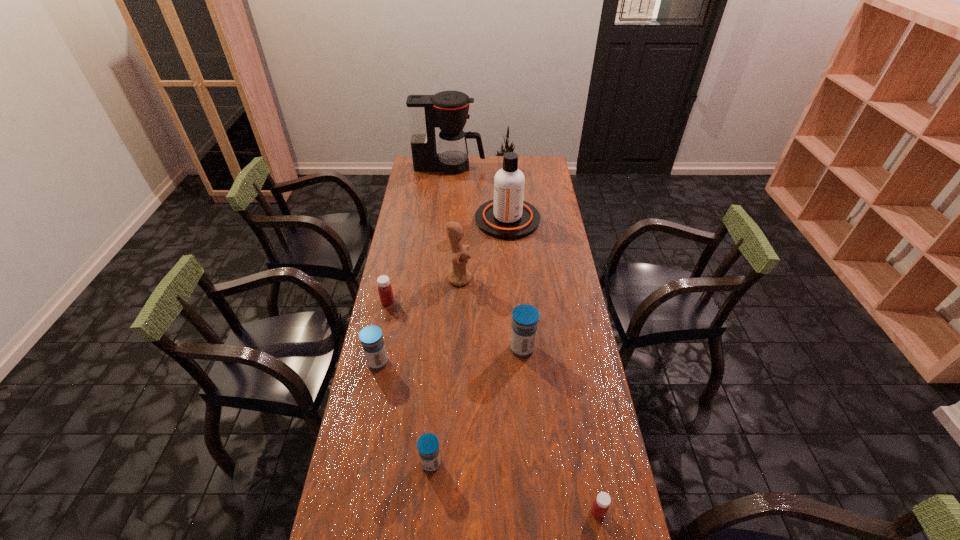
Where is `the fourth farthest object`? the fourth farthest object is located at coordinates (385, 291).

The image size is (960, 540). I want to click on the second blue medicine from right to left, so click(x=428, y=444).

This screenshot has height=540, width=960. In order to click on the smallest blue medicine in this screenshot , I will do `click(428, 444)`.

Where is `the shortest object`? the shortest object is located at coordinates (600, 506).

At what (x,y) coordinates should I click in order to perform the action: click on the nearer red medicine. Please return your answer as a coordinate pair (x, y). The image size is (960, 540). Looking at the image, I should click on (600, 506).

Locate an element on the screen. The width and height of the screenshot is (960, 540). free space located 0.110m pour from the carafe of the coffee maker is located at coordinates (505, 166).

I want to click on vacant space positioned on the back of the seventh nearest object, so click(505, 188).

This screenshot has width=960, height=540. Identify the location of vacant space located on the front-facing side of the sixth shortest object. (543, 278).

Find the location of a particular element. vacant region located on the left of the tallest medicine is located at coordinates (423, 348).

Locate an element on the screen. This screenshot has width=960, height=540. free space located 0.140m on the right of the second smallest blue medicine is located at coordinates (430, 362).